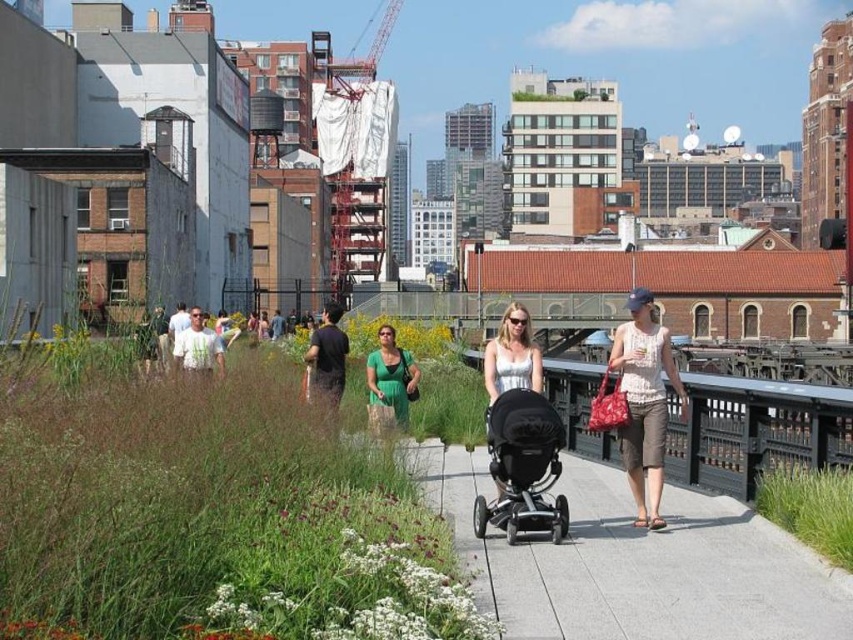
Question: Based on their relative distances, which object is farther from the dark gray fabric pants at center?

Choices:
 (A) silver metallic dress at center
 (B) white lace tank top at center
 (C) green matte dress at center
 (D) black matte stroller at center

Answer: (D)

Question: Among these points, which one is nearest to the camera?

Choices:
 (A) (483, 561)
 (B) (506, 486)
 (C) (398, 401)

Answer: (A)

Question: Is silver metallic dress at center thinner than dark gray fabric pants at center?

Choices:
 (A) yes
 (B) no

Answer: (A)

Question: From the image, what is the correct spatial relationship of black matte stroller at center in relation to dark gray fabric pants at center?

Choices:
 (A) above
 (B) below

Answer: (B)

Question: Which object is the closest to the smooth concrete pavement at center?

Choices:
 (A) silver metallic dress at center
 (B) dark gray fabric pants at center
 (C) white lace tank top at center

Answer: (C)

Question: Does smooth concrete pavement at center appear under white lace tank top at center?

Choices:
 (A) yes
 (B) no

Answer: (A)